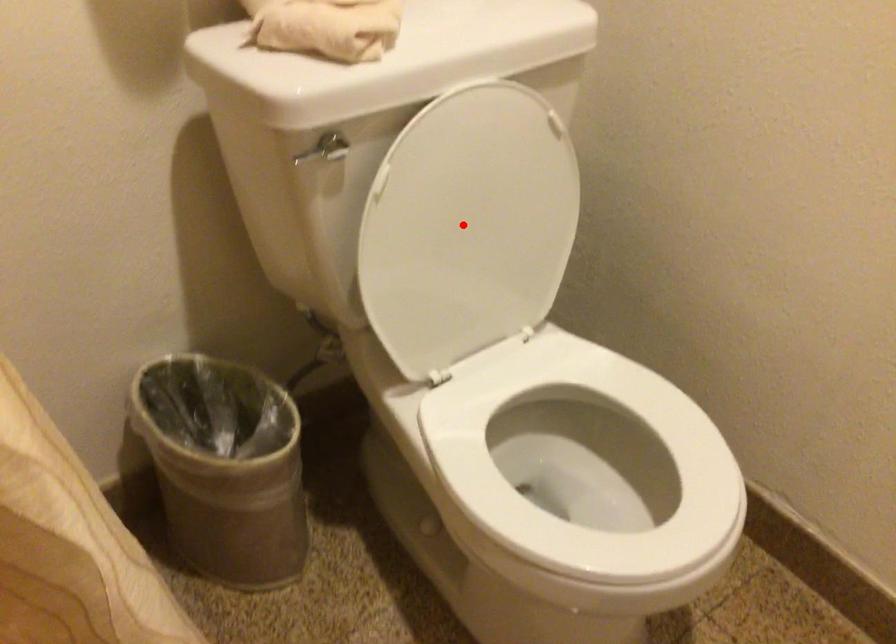
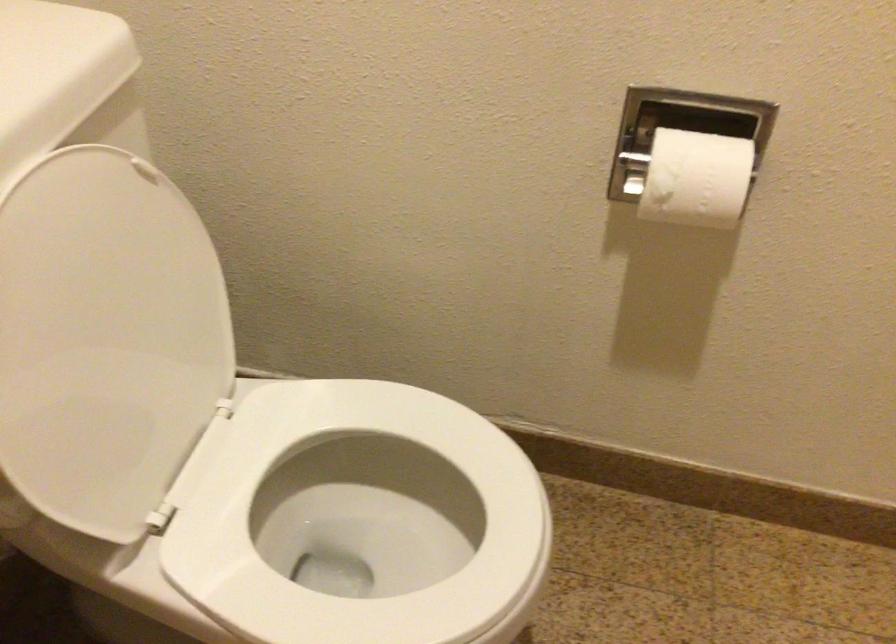
Find the pixel in the second image that matches the highlighted location in the first image.

(105, 339)